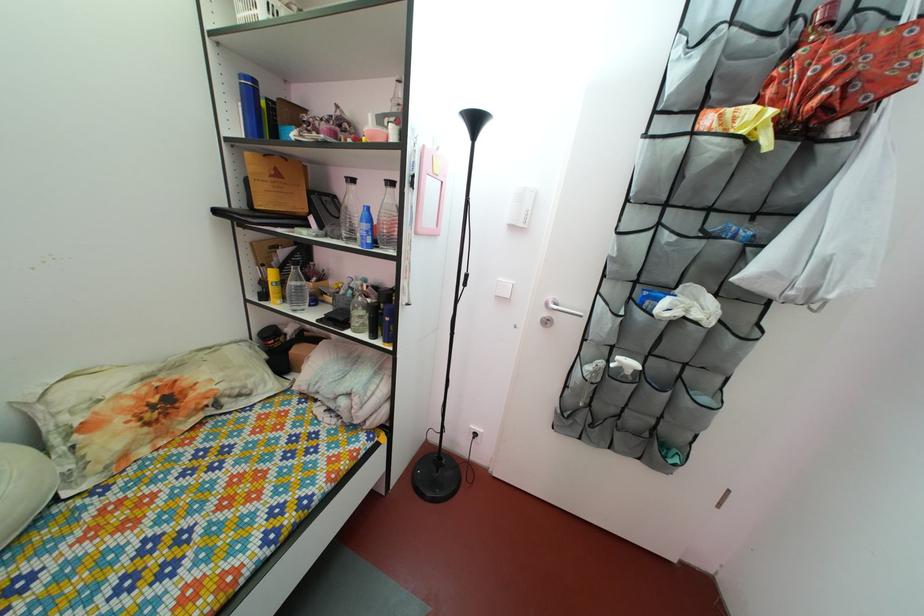
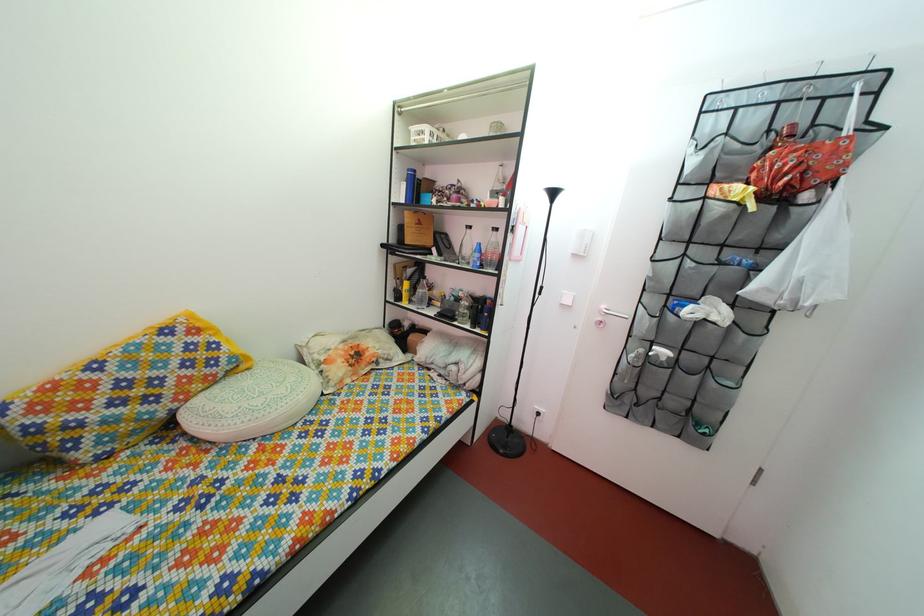
Question: Which direction would the cameraman need to move to produce the second image? Reply with the corresponding letter.

Choices:
 (A) Left
 (B) Right
 (C) Forward
 (D) Backward

Answer: (D)